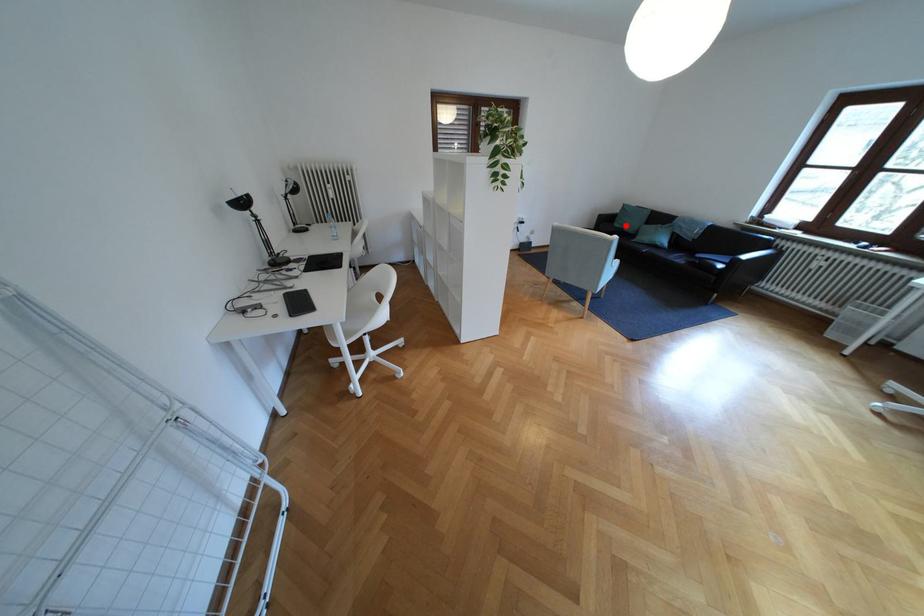
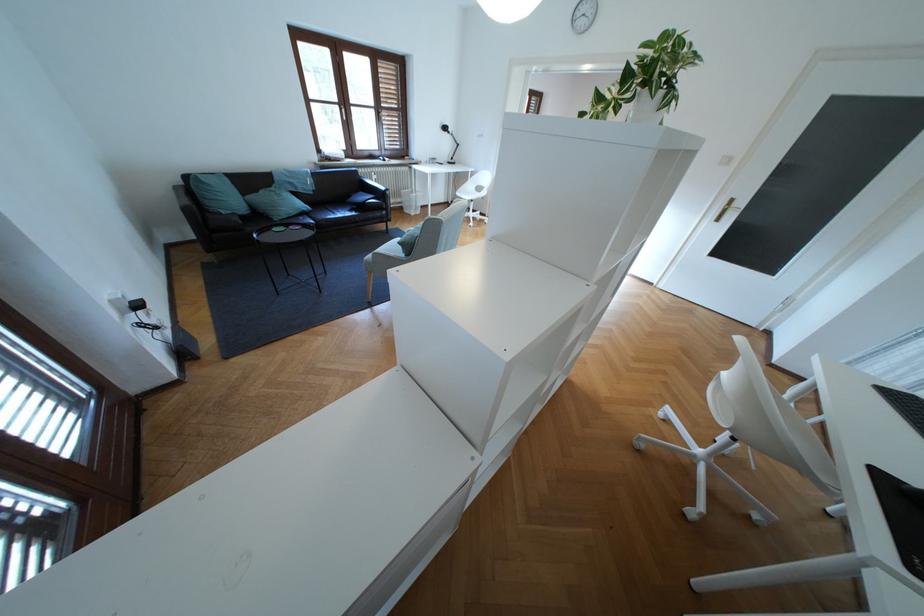
Question: I am providing you with two images of the same scene from different viewpoints. In image1, a red point is highlighted. Considering the same 3D point in image2, which of the following is correct?

Choices:
 (A) It is closer
 (B) It is farther

Answer: (A)